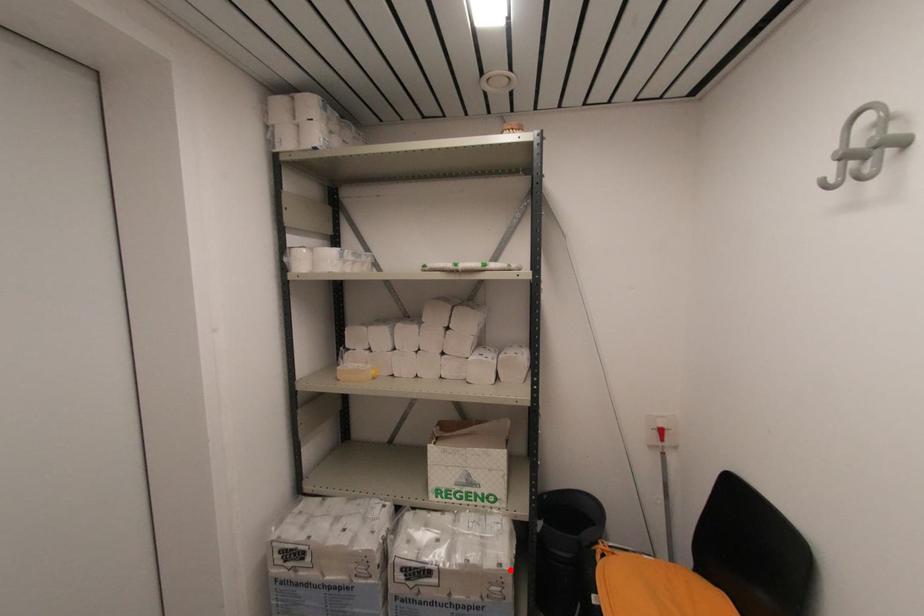
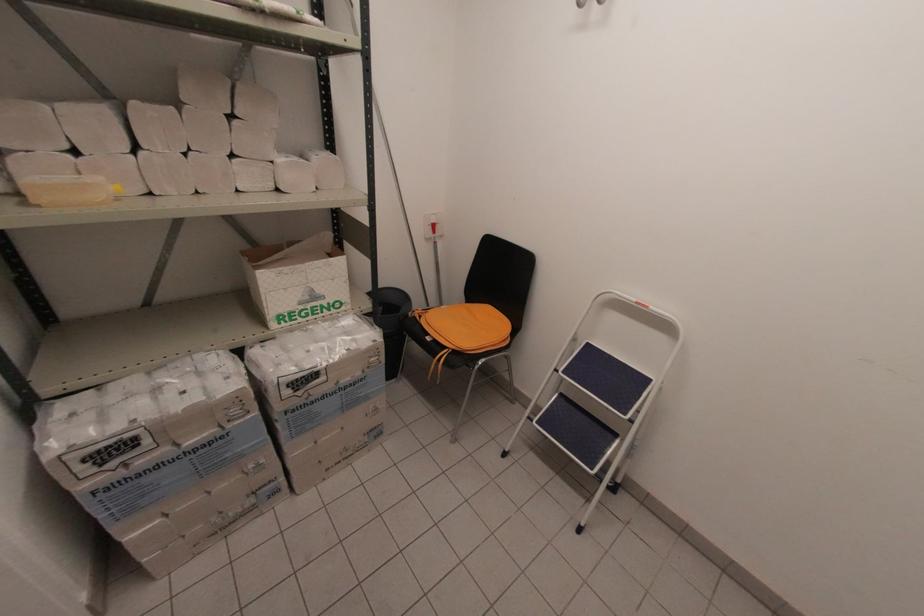
Where in the second image is the point corresponding to the highlighted location from the first image?

(383, 341)